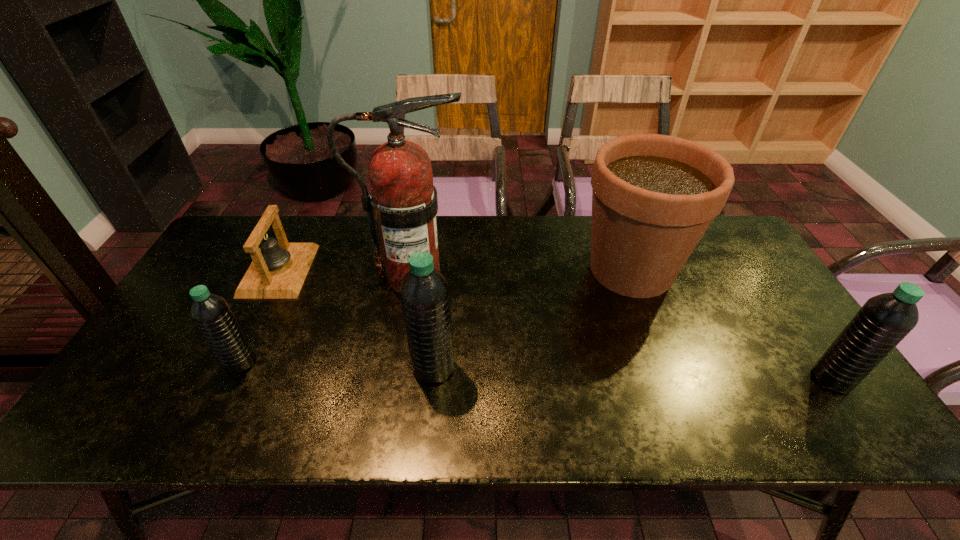
Locate an element on the screen. This screenshot has height=540, width=960. the shortest water bottle is located at coordinates (211, 313).

The image size is (960, 540). I want to click on the leftmost water bottle, so click(211, 313).

Where is `the second water bottle from left to right`? The width and height of the screenshot is (960, 540). the second water bottle from left to right is located at coordinates (424, 292).

At what (x,y) coordinates should I click in order to perform the action: click on the rightmost object. Please return your answer as a coordinate pair (x, y). Looking at the image, I should click on (884, 320).

This screenshot has width=960, height=540. Identify the location of the rightmost water bottle. tap(884, 320).

This screenshot has height=540, width=960. In order to click on flowerpot in this screenshot , I will do `click(653, 196)`.

The image size is (960, 540). Find the location of `bell`. bell is located at coordinates (278, 270).

I want to click on fire extinguisher, so click(403, 201).

Locate an element on the screen. The width and height of the screenshot is (960, 540). free space located 0.360m on the right of the second shortest object is located at coordinates (401, 362).

Identify the location of free location located 0.390m on the right of the second water bottle from right to left. Image resolution: width=960 pixels, height=540 pixels. (613, 368).